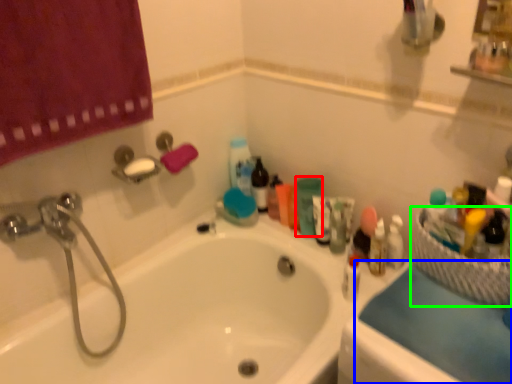
Question: Which object is the farthest from toiletry (highlighted by a red box)? Choose among these: counter top (highlighted by a blue box) or basket (highlighted by a green box).

Choices:
 (A) counter top
 (B) basket

Answer: (A)